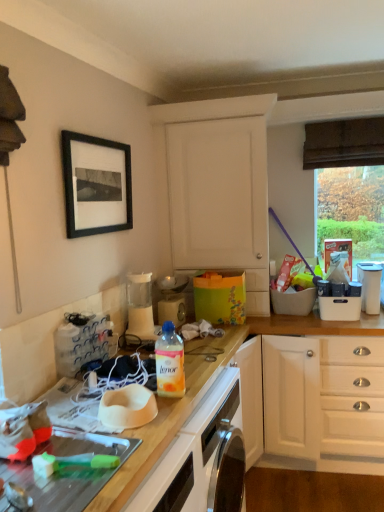
Question: Considering the relative sizes of white matte cabinet at upper center and white plastic container at upper right, acting as the second appliance starting from the left, in the image provided, is white matte cabinet at upper center wider than white plastic container at upper right, acting as the second appliance starting from the left,?

Choices:
 (A) no
 (B) yes

Answer: (B)

Question: Is white matte cabinet at upper center oriented towards white plastic container at upper right, the 1th appliance when ordered from right to left?

Choices:
 (A) yes
 (B) no

Answer: (B)

Question: Does white matte cabinet at upper center have a smaller size compared to white plastic container at upper right, the 1th appliance when ordered from right to left?

Choices:
 (A) yes
 (B) no

Answer: (B)

Question: Considering the relative positions of white matte cabinet at upper center and white plastic container at upper right, acting as the second appliance starting from the left, in the image provided, is white matte cabinet at upper center to the right of white plastic container at upper right, acting as the second appliance starting from the left, from the viewer's perspective?

Choices:
 (A) yes
 (B) no

Answer: (B)

Question: Is white matte cabinet at upper center not close to white plastic container at upper right, the 1th appliance when ordered from right to left?

Choices:
 (A) no
 (B) yes

Answer: (A)

Question: From a real-world perspective, is white matte cabinet at upper center on top of white plastic container at upper right, the 1th appliance when ordered from right to left?

Choices:
 (A) no
 (B) yes

Answer: (B)

Question: Are black matte picture frame at upper left and translucent plastic bottle at center far apart?

Choices:
 (A) yes
 (B) no

Answer: (B)

Question: Is translucent plastic bottle at center at the back of black matte picture frame at upper left?

Choices:
 (A) yes
 (B) no

Answer: (B)

Question: From a real-world perspective, does black matte picture frame at upper left stand above translucent plastic bottle at center?

Choices:
 (A) yes
 (B) no

Answer: (A)

Question: Considering the relative sizes of black matte picture frame at upper left and translucent plastic bottle at center in the image provided, is black matte picture frame at upper left bigger than translucent plastic bottle at center?

Choices:
 (A) no
 (B) yes

Answer: (B)

Question: Is black matte picture frame at upper left outside translucent plastic bottle at center?

Choices:
 (A) yes
 (B) no

Answer: (A)

Question: Is black matte picture frame at upper left positioned in front of translucent plastic bottle at center?

Choices:
 (A) yes
 (B) no

Answer: (B)

Question: Is white matte cabinet at upper center smaller than white glossy oven at lower center?

Choices:
 (A) yes
 (B) no

Answer: (B)